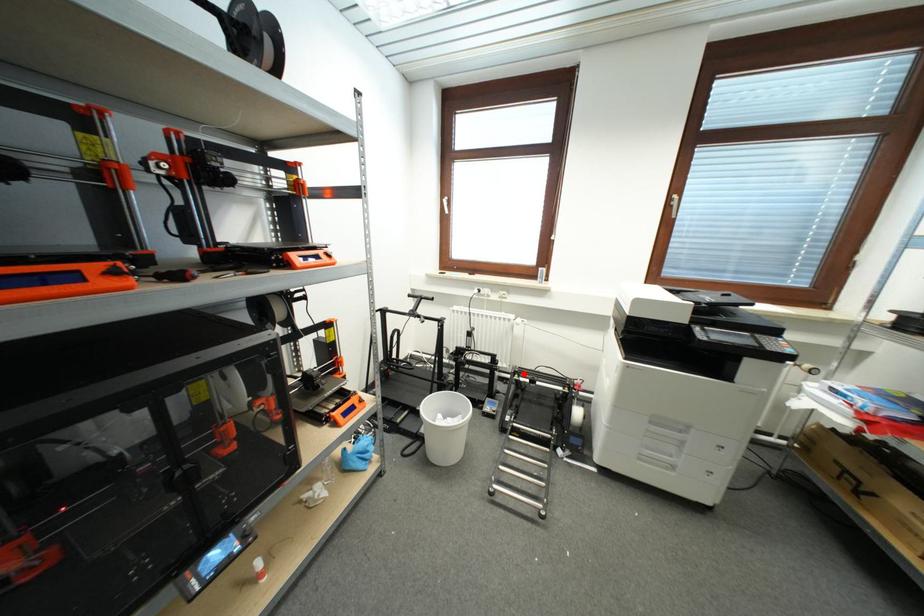
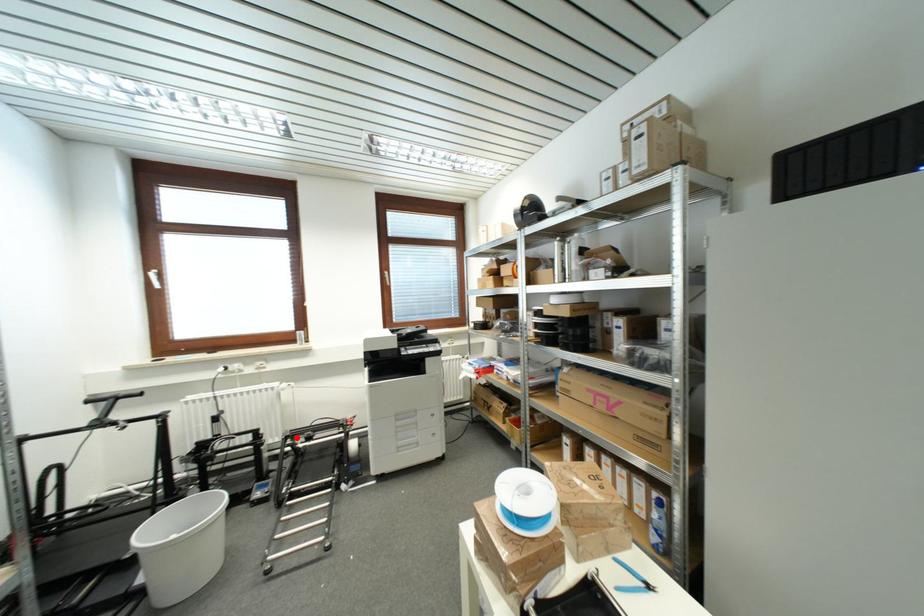
In the scene shown: I am providing you with two images of the same scene from different viewpoints. A red point is marked on the first image and another point is marked on the second image. Is the red point in image1 aligned with the point shown in image2?

Yes